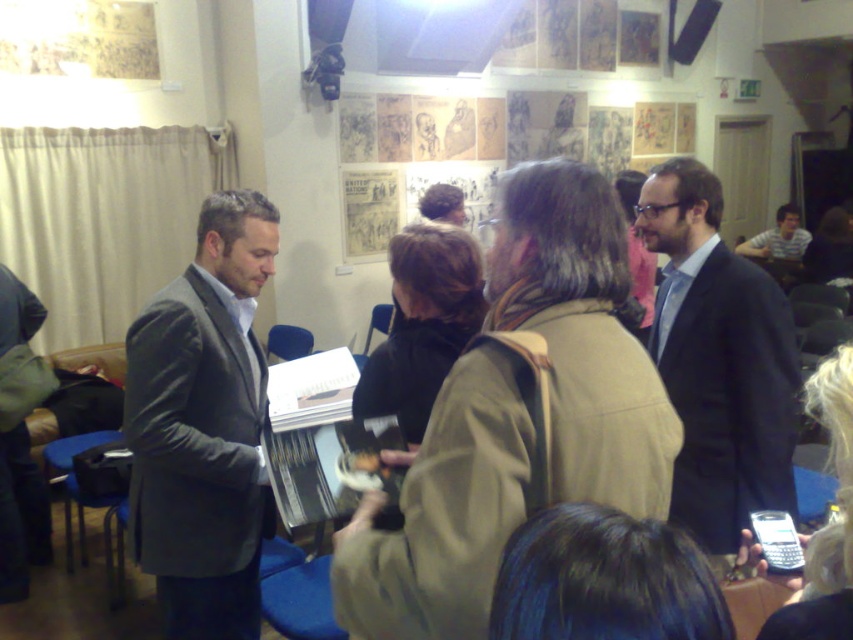
Consider the image. Is matte gray suit at center below striped shirt at center?

Yes.

Which is more to the left, matte gray suit at center or striped shirt at center?

From the viewer's perspective, matte gray suit at center appears more on the left side.

Is point (247, 474) farther from camera compared to point (782, 250)?

No, it is not.

What are the coordinates of `matte gray suit at center` in the screenshot? It's located at (202, 426).

Between matte gray suit at center and dark blue suit at center, which one is positioned higher?

dark blue suit at center

Does matte gray suit at center have a lesser width compared to dark blue suit at center?

Yes.

Is point (218, 410) farther from camera compared to point (689, 172)?

No, (218, 410) is in front of (689, 172).

At what (x,y) coordinates should I click in order to perform the action: click on matte gray suit at center. Please return your answer as a coordinate pair (x, y). This screenshot has height=640, width=853. Looking at the image, I should click on point(202,426).

Which is more to the left, dark blue suit at center or striped shirt at center?

Positioned to the left is dark blue suit at center.

Measure the distance between point (653, 232) and camera.

They are 2.12 meters apart.

Identify the location of dark blue suit at center. (718, 362).